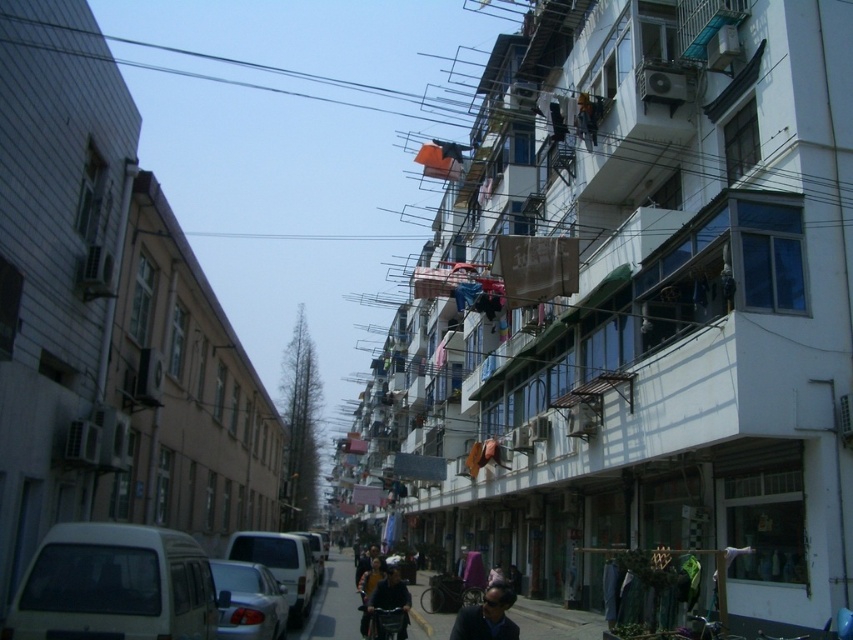
You are standing at the center of the street and want to walk to the white matte van at lower left. Which direction should you walk?

Since the white matte van at lower left is located at point (114, 586), you should walk towards the lower left direction to reach it.

You are a delivery person standing at the entrance of the street. You need to deliver a package to the person wearing the dark blue jacket at center. The silver metallic van at center is blocking your path. Can you walk around the van to reach the person?

The silver metallic van at center is to the left of dark blue jacket at center. Since the van is on the left side of the person, you can walk around the van to the right side to reach the person wearing the dark blue jacket at center.

You are a delivery person trying to park your van in this narrow street. The silver metallic van at center is currently blocking the parking spot you need. Can you maneuver around it without hitting the dark blue jacket at center?

The silver metallic van at center is larger than the dark blue jacket at center, so you can maneuver around it without hitting the dark blue jacket at center.